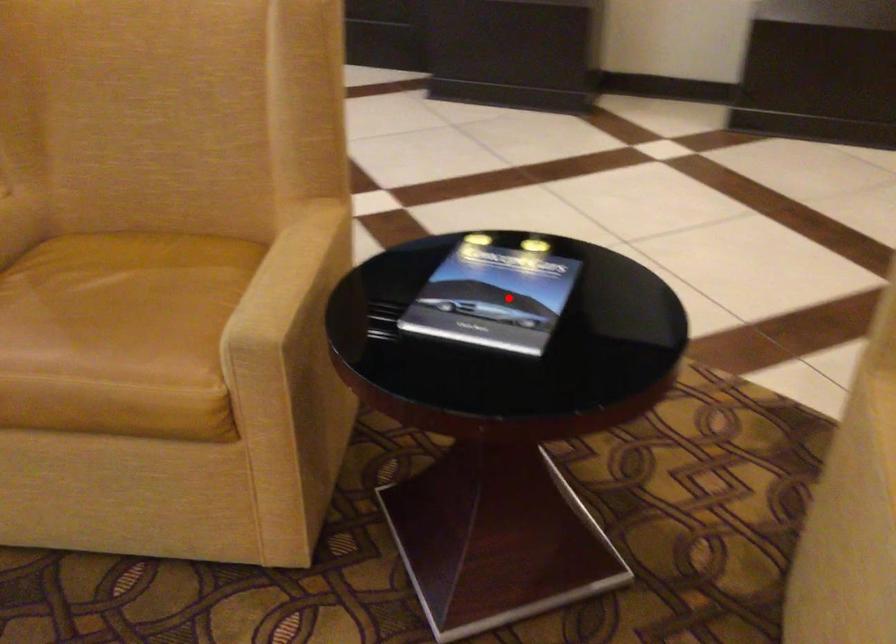
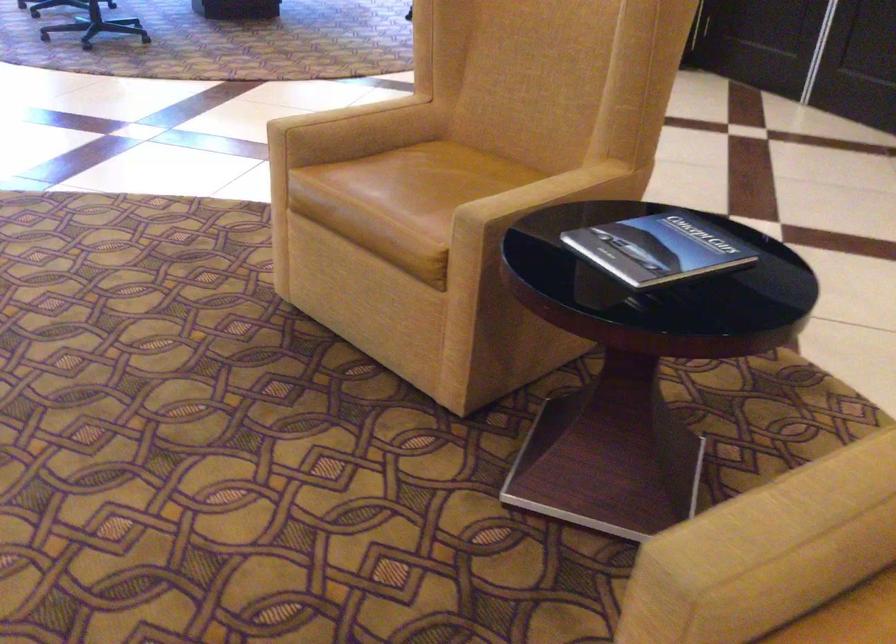
Question: I am providing you with two images of the same scene from different viewpoints. A red point is shown in image1. For the corresponding object point in image2, is it positioned nearer or farther from the camera?

Choices:
 (A) Nearer
 (B) Farther

Answer: (B)